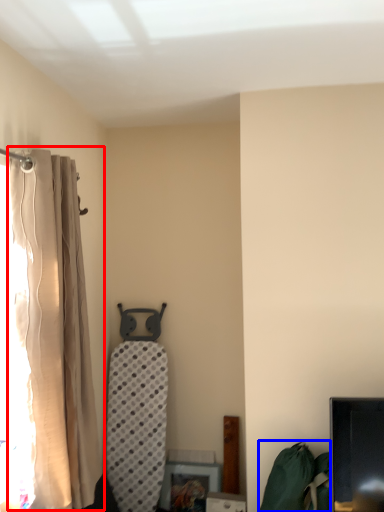
Question: Among these objects, which one is nearest to the camera, curtain (highlighted by a red box) or bean bag chair (highlighted by a blue box)?

Choices:
 (A) curtain
 (B) bean bag chair

Answer: (A)